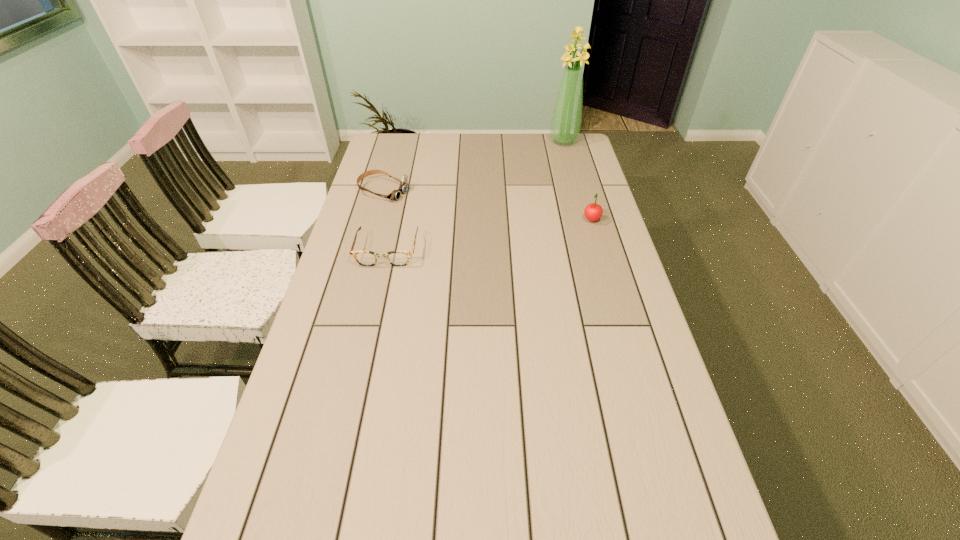
In the image, there is a desktop. Where is `vacant space at the far edge`? This screenshot has height=540, width=960. vacant space at the far edge is located at coordinates (513, 151).

Find the location of a particular element. vacant area at the near edge of the desktop is located at coordinates (341, 531).

Find the location of a particular element. The width and height of the screenshot is (960, 540). vacant space at the left edge of the desktop is located at coordinates (395, 214).

Locate an element on the screen. This screenshot has width=960, height=540. vacant space at the right edge of the desktop is located at coordinates (610, 384).

I want to click on free space at the far right corner, so click(x=564, y=156).

At what (x,y) coordinates should I click in order to perform the action: click on empty space between the nearest object and the second tallest object. Please return your answer as a coordinate pair (x, y). Looking at the image, I should click on (490, 235).

The width and height of the screenshot is (960, 540). What are the coordinates of `free space that is in between the tallest object and the nearest object` in the screenshot? It's located at (475, 196).

At what (x,y) coordinates should I click in order to perform the action: click on vacant space that's between the second nearest object and the nearest object. Please return your answer as a coordinate pair (x, y). The width and height of the screenshot is (960, 540). Looking at the image, I should click on (490, 235).

Where is `empty location between the spectacles and the farthest object`? empty location between the spectacles and the farthest object is located at coordinates (475, 196).

Image resolution: width=960 pixels, height=540 pixels. What are the coordinates of `free area in between the cherry and the nearest object` in the screenshot? It's located at (490, 235).